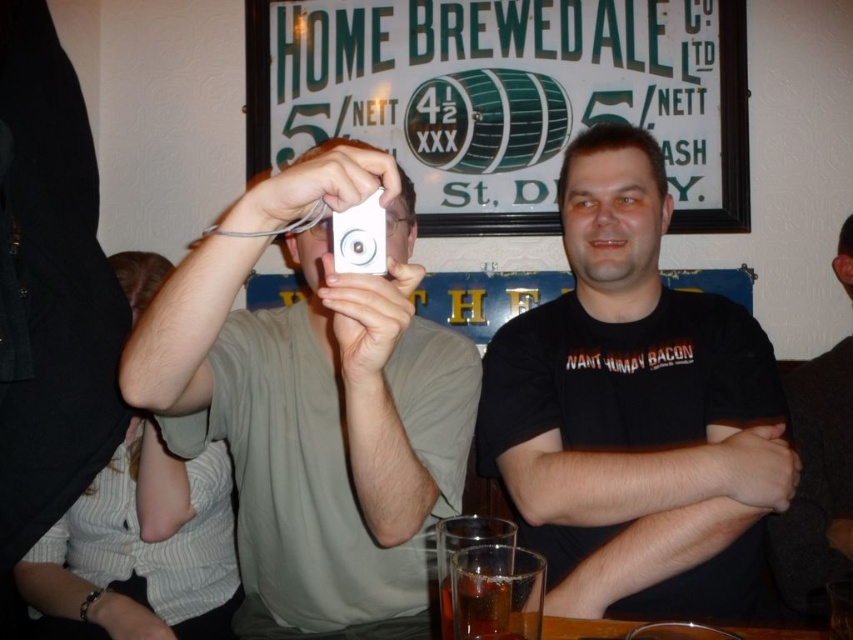
Which is more to the left, black matte shirt at center or white plastic game controller at upper center?

white plastic game controller at upper center

Which is below, black matte shirt at center or white plastic game controller at upper center?

black matte shirt at center is lower down.

The image size is (853, 640). Describe the element at coordinates (634, 410) in the screenshot. I see `black matte shirt at center` at that location.

Where is `black matte shirt at center`? black matte shirt at center is located at coordinates [x=634, y=410].

Between white matte camera at center and white plastic game controller at upper center, which one appears on the left side from the viewer's perspective?

white matte camera at center is more to the left.

Is point (469, 380) closer to camera compared to point (358, 225)?

No, it is not.

This screenshot has height=640, width=853. Find the location of `white matte camera at center`. white matte camera at center is located at coordinates (316, 400).

Which is in front, point (216, 310) or point (712, 404)?

Positioned in front is point (216, 310).

Is point (445, 509) behind point (693, 413)?

No, (445, 509) is closer to viewer.

Where is `white matte camera at center`? This screenshot has width=853, height=640. white matte camera at center is located at coordinates (316, 400).